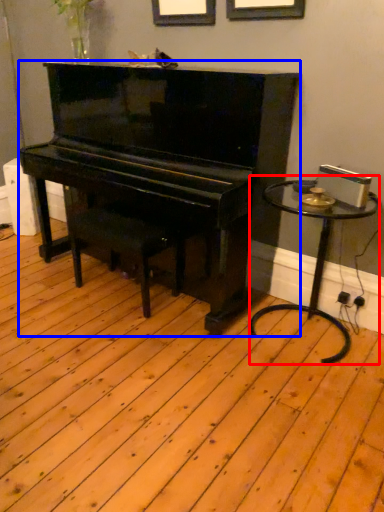
Question: Among these objects, which one is nearest to the camera, table (highlighted by a red box) or piano (highlighted by a blue box)?

Choices:
 (A) table
 (B) piano

Answer: (B)